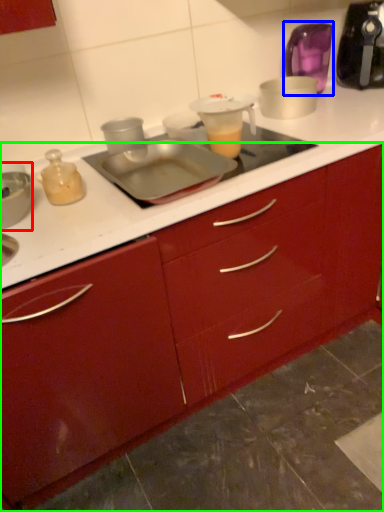
Question: Based on their relative distances, which object is nearer to appliance (highlighted by a red box)? Choose from appliance (highlighted by a blue box) and cabinetry (highlighted by a green box).

Choices:
 (A) appliance
 (B) cabinetry

Answer: (B)